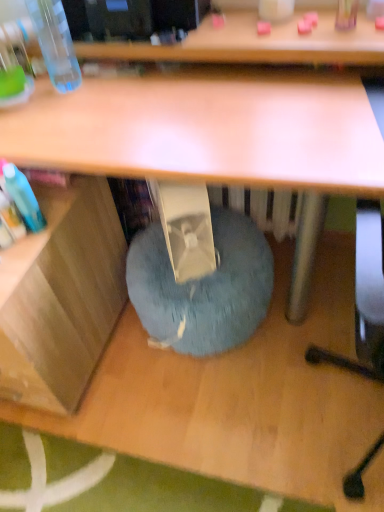
Question: Considering the relative positions of wooden at left and transparent plastic bottle at upper left in the image provided, is wooden at left to the left or to the right of transparent plastic bottle at upper left?

Choices:
 (A) right
 (B) left

Answer: (B)

Question: Is wooden at left taller or shorter than transparent plastic bottle at upper left?

Choices:
 (A) tall
 (B) short

Answer: (A)

Question: Which of these objects is positioned farthest from the blue fuzzy bean bag at lower center?

Choices:
 (A) transparent plastic bottle at upper left
 (B) wooden at left

Answer: (A)

Question: Considering the real-world distances, which object is farthest from the wooden at left?

Choices:
 (A) blue fuzzy bean bag at lower center
 (B) transparent plastic bottle at upper left

Answer: (B)